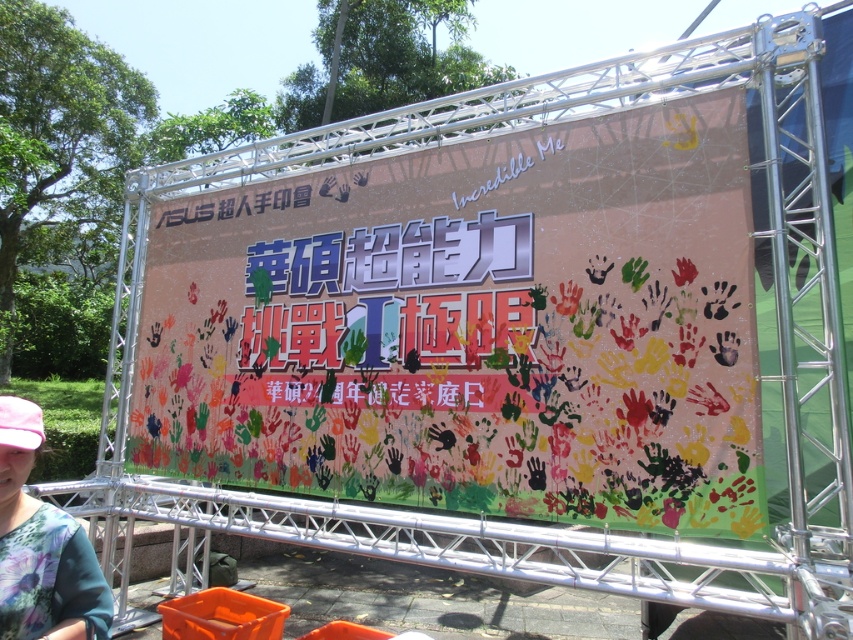
Is floral fabric shirt at lower left smaller than orange plastic crate at lower center?

Yes, floral fabric shirt at lower left is smaller than orange plastic crate at lower center.

Which of these two, floral fabric shirt at lower left or orange plastic crate at lower center, stands taller?

Standing taller between the two is floral fabric shirt at lower left.

Image resolution: width=853 pixels, height=640 pixels. I want to click on floral fabric shirt at lower left, so click(x=41, y=547).

I want to click on floral fabric shirt at lower left, so click(41, 547).

Can you confirm if multicolored painted hands at center is positioned above floral fabric shirt at lower left?

Yes.

Can you confirm if multicolored painted hands at center is smaller than floral fabric shirt at lower left?

No.

Identify the location of multicolored painted hands at center. The image size is (853, 640). pyautogui.click(x=473, y=328).

Locate an element on the screen. multicolored painted hands at center is located at coordinates (473, 328).

Which is behind, point (646, 518) or point (280, 612)?

Positioned behind is point (280, 612).

Which of these two, multicolored painted hands at center or orange plastic crate at lower center, stands taller?

Standing taller between the two is multicolored painted hands at center.

The width and height of the screenshot is (853, 640). What do you see at coordinates (473, 328) in the screenshot? I see `multicolored painted hands at center` at bounding box center [473, 328].

You are a GUI agent. You are given a task and a screenshot of the screen. Output one action in this format:
    pyautogui.click(x=<x>, y=<y>)
    Task: Click on the multicolored painted hands at center
    The width and height of the screenshot is (853, 640).
    Given the screenshot: What is the action you would take?
    pyautogui.click(x=473, y=328)